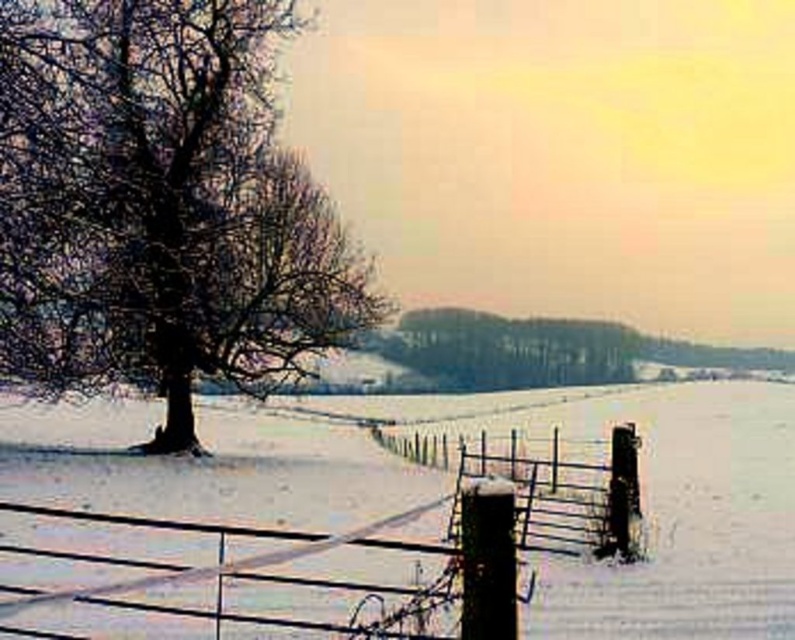
Question: Is rusty wire fence at lower center to the left of snow-covered wooden fence post at lower right from the viewer's perspective?

Choices:
 (A) yes
 (B) no

Answer: (A)

Question: Which point is closer to the camera taking this photo?

Choices:
 (A) (728, 422)
 (B) (564, 481)
 (C) (332, 624)
 (D) (196, 317)

Answer: (C)

Question: Can you confirm if white frosty snow at center is positioned to the left of snow-covered wooden fence post at lower right?

Choices:
 (A) no
 (B) yes

Answer: (B)

Question: Which object is farther from the camera taking this photo?

Choices:
 (A) rusty wire fence at lower center
 (B) white frosty snow at center
 (C) snow-covered wooden fence post at lower right
 (D) snow-covered tree at left

Answer: (D)

Question: Which object appears closest to the camera in this image?

Choices:
 (A) white frosty snow at center
 (B) snow-covered wooden fence post at lower right
 (C) rusty wire fence at lower center

Answer: (C)

Question: Can you confirm if snow-covered tree at left is wider than snow-covered wooden fence post at lower right?

Choices:
 (A) yes
 (B) no

Answer: (A)